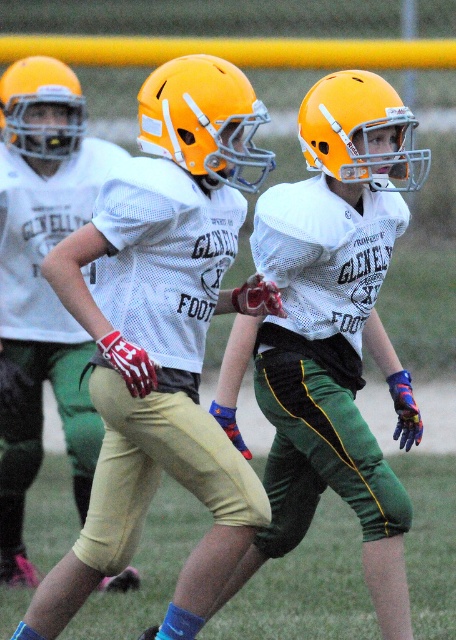
You are a photographer trying to capture a closeup of the matte white jersey at center and the matte yellow helmet at upper left. Which object should you zoom in on to ensure it fills the frame more?

The matte white jersey at center is larger in size than the matte yellow helmet at upper left, so zooming in on the matte white jersey at center will fill the frame more.

You are a referee at a youth football game. You need to determine if the two players with the matte orange helmet at center and the matte yellow helmet at center are within the required 18 inches of each other for a legal tackle. Can you confirm?

The matte orange helmet at center and matte yellow helmet at center are 18.55 inches apart, which is slightly over the required 18 inches for a legal tackle. Therefore, they are not within the required distance.